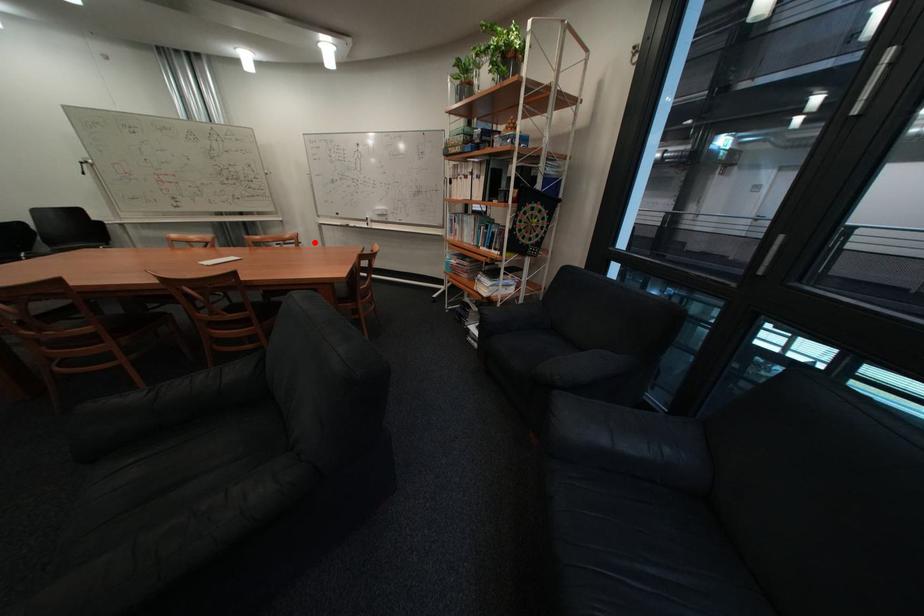
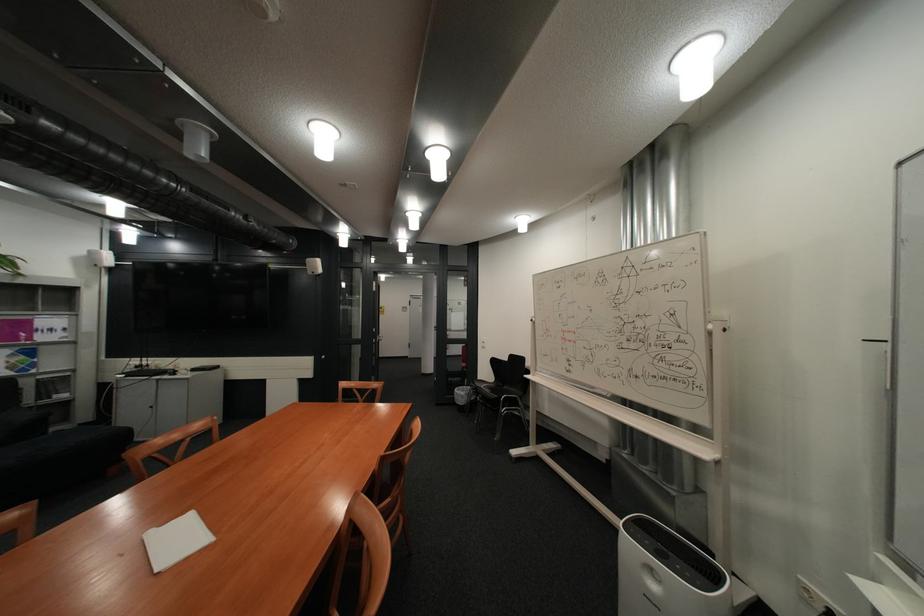
Find the pixel in the second image that matches the highlighted location in the first image.

(728, 576)